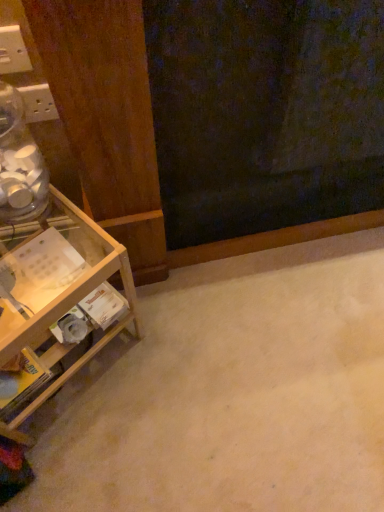
Question: Is white plastic electric outlet at upper left, which ranks as the second electric outlet in bottom-to-top order, with white plastic electric outlet at upper left, the 1th electric outlet viewed from the back?

Choices:
 (A) yes
 (B) no

Answer: (A)

Question: Can you confirm if white plastic electric outlet at upper left, marked as the second electric outlet in a back-to-front arrangement, is wider than white plastic electric outlet at upper left, the 2th electric outlet when ordered from front to back?

Choices:
 (A) yes
 (B) no

Answer: (B)

Question: Does white plastic electric outlet at upper left, the 1th electric outlet in the front-to-back sequence, contain white plastic electric outlet at upper left, acting as the 2th electric outlet starting from the top?

Choices:
 (A) no
 (B) yes

Answer: (A)

Question: From a real-world perspective, is white plastic electric outlet at upper left, the 1th electric outlet in the front-to-back sequence, on white plastic electric outlet at upper left, acting as the 2th electric outlet starting from the top?

Choices:
 (A) no
 (B) yes

Answer: (B)

Question: Does white plastic electric outlet at upper left, the 1th electric outlet positioned from the top, appear on the right side of white plastic electric outlet at upper left, positioned as the first electric outlet in bottom-to-top order?

Choices:
 (A) yes
 (B) no

Answer: (A)

Question: From a real-world perspective, is white plastic electric outlet at upper left, marked as the second electric outlet in a back-to-front arrangement, physically located above or below wooden shelf at left?

Choices:
 (A) above
 (B) below

Answer: (A)

Question: Is white plastic electric outlet at upper left, the 1th electric outlet positioned from the top, spatially inside wooden shelf at left, or outside of it?

Choices:
 (A) outside
 (B) inside

Answer: (A)

Question: From their relative heights in the image, would you say white plastic electric outlet at upper left, the 1th electric outlet positioned from the top, is taller or shorter than wooden shelf at left?

Choices:
 (A) short
 (B) tall

Answer: (A)

Question: Considering the positions of point (26, 56) and point (125, 318), is point (26, 56) closer or farther from the camera than point (125, 318)?

Choices:
 (A) farther
 (B) closer

Answer: (B)

Question: From the image's perspective, is wooden shelf at left above or below white plastic electric outlet at upper left, marked as the second electric outlet in a back-to-front arrangement?

Choices:
 (A) below
 (B) above

Answer: (A)

Question: Is wooden shelf at left in front of or behind white plastic electric outlet at upper left, the 1th electric outlet in the front-to-back sequence, in the image?

Choices:
 (A) behind
 (B) front

Answer: (B)

Question: Looking at the image, does wooden shelf at left seem bigger or smaller compared to white plastic electric outlet at upper left, the 1th electric outlet in the front-to-back sequence?

Choices:
 (A) small
 (B) big

Answer: (B)

Question: Is wooden shelf at left inside or outside of white plastic electric outlet at upper left, the 1th electric outlet in the front-to-back sequence?

Choices:
 (A) inside
 (B) outside

Answer: (B)

Question: In terms of size, does white plastic electric outlet at upper left, which ranks as the second electric outlet in bottom-to-top order, appear bigger or smaller than white plastic electric outlet at upper left, positioned as the first electric outlet in bottom-to-top order?

Choices:
 (A) big
 (B) small

Answer: (B)

Question: Is point (6, 27) positioned closer to the camera than point (31, 120)?

Choices:
 (A) farther
 (B) closer

Answer: (B)